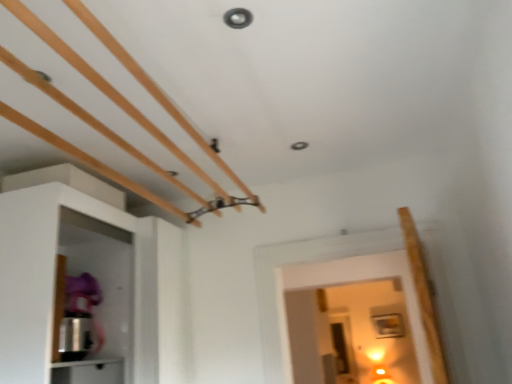
What do you see at coordinates (99, 285) in the screenshot? The image size is (512, 384). I see `white matte cabinet at left, which appears as the 1th cabinetry when viewed from the top` at bounding box center [99, 285].

The width and height of the screenshot is (512, 384). I want to click on white matte cabinet at left, which appears as the 1th cabinetry when viewed from the top, so click(x=99, y=285).

Identify the location of white glossy cabinet at lower left, the first cabinetry from the bottom. The height and width of the screenshot is (384, 512). (88, 372).

In order to face white glossy cabinet at lower left, the first cabinetry from the bottom, should I rotate leftwards or rightwards?

To face it directly, rotate left by 22.761 degrees.

What do you see at coordinates (88, 372) in the screenshot?
I see `white glossy cabinet at lower left, the first cabinetry from the bottom` at bounding box center [88, 372].

Where is `white matte cabinet at left, which appears as the 1th cabinetry when viewed from the top`? The image size is (512, 384). white matte cabinet at left, which appears as the 1th cabinetry when viewed from the top is located at coordinates (99, 285).

Can you confirm if white matte cabinet at left, the second cabinetry from the bottom, is positioned to the right of white glossy cabinet at lower left, the first cabinetry from the bottom?

Incorrect, white matte cabinet at left, the second cabinetry from the bottom, is not on the right side of white glossy cabinet at lower left, the first cabinetry from the bottom.

Who is more distant, white matte cabinet at left, the second cabinetry from the bottom, or white glossy cabinet at lower left, the first cabinetry from the bottom?

white glossy cabinet at lower left, the first cabinetry from the bottom, is further from the camera.

Which is closer to the camera, (7,232) or (83,382)?

Point (7,232) appears to be closer to the viewer than point (83,382).

From the image's perspective, between white matte cabinet at left, the second cabinetry from the bottom, and white glossy cabinet at lower left, the second cabinetry viewed from the top, who is located below?

white glossy cabinet at lower left, the second cabinetry viewed from the top, is shown below in the image.

From a real-world perspective, does white matte cabinet at left, the second cabinetry from the bottom, stand above white glossy cabinet at lower left, the second cabinetry viewed from the top?

Yes, from a real-world perspective, white matte cabinet at left, the second cabinetry from the bottom, is on top of white glossy cabinet at lower left, the second cabinetry viewed from the top.

Considering the sizes of white matte cabinet at left, the second cabinetry from the bottom, and white glossy cabinet at lower left, the first cabinetry from the bottom, in the image, is white matte cabinet at left, the second cabinetry from the bottom, wider or thinner than white glossy cabinet at lower left, the first cabinetry from the bottom,?

Considering their sizes, white matte cabinet at left, the second cabinetry from the bottom, looks broader than white glossy cabinet at lower left, the first cabinetry from the bottom.

Between white matte cabinet at left, the second cabinetry from the bottom, and white glossy cabinet at lower left, the first cabinetry from the bottom, which one has more height?

Standing taller between the two is white matte cabinet at left, the second cabinetry from the bottom.

Which of these two, white matte cabinet at left, the second cabinetry from the bottom, or white glossy cabinet at lower left, the second cabinetry viewed from the top, is smaller?

white glossy cabinet at lower left, the second cabinetry viewed from the top, is smaller.

Based on the photo, would you say white matte cabinet at left, which appears as the 1th cabinetry when viewed from the top, is outside white glossy cabinet at lower left, the first cabinetry from the bottom?

white matte cabinet at left, which appears as the 1th cabinetry when viewed from the top, is positioned outside white glossy cabinet at lower left, the first cabinetry from the bottom.

Is white matte cabinet at left, which appears as the 1th cabinetry when viewed from the top, touching white glossy cabinet at lower left, the second cabinetry viewed from the top?

No.

Is white matte cabinet at left, which appears as the 1th cabinetry when viewed from the top, positioned with its back to white glossy cabinet at lower left, the second cabinetry viewed from the top?

Yes, white glossy cabinet at lower left, the second cabinetry viewed from the top, is at the back of white matte cabinet at left, which appears as the 1th cabinetry when viewed from the top.

How many degrees apart are the facing directions of white matte cabinet at left, which appears as the 1th cabinetry when viewed from the top, and white glossy cabinet at lower left, the second cabinetry viewed from the top?

The angular difference between white matte cabinet at left, which appears as the 1th cabinetry when viewed from the top, and white glossy cabinet at lower left, the second cabinetry viewed from the top, is 1.78 degrees.

Identify the location of cabinetry to the right of white matte cabinet at left, the second cabinetry from the bottom. This screenshot has width=512, height=384. (88, 372).

Between white glossy cabinet at lower left, the first cabinetry from the bottom, and white matte cabinet at left, the second cabinetry from the bottom, which one appears on the left side from the viewer's perspective?

white matte cabinet at left, the second cabinetry from the bottom, is more to the left.

Is white glossy cabinet at lower left, the second cabinetry viewed from the top, in front of or behind white matte cabinet at left, which appears as the 1th cabinetry when viewed from the top, in the image?

In the image, white glossy cabinet at lower left, the second cabinetry viewed from the top, appears behind white matte cabinet at left, which appears as the 1th cabinetry when viewed from the top.

Is point (87, 361) farther from camera compared to point (20, 283)?

Yes, it is behind point (20, 283).

Looking at this image, from the image's perspective, is white glossy cabinet at lower left, the first cabinetry from the bottom, on white matte cabinet at left, the second cabinetry from the bottom?

No.

From a real-world perspective, which is physically below, white glossy cabinet at lower left, the second cabinetry viewed from the top, or white matte cabinet at left, the second cabinetry from the bottom?

white glossy cabinet at lower left, the second cabinetry viewed from the top, from a real-world perspective.

In terms of width, does white glossy cabinet at lower left, the first cabinetry from the bottom, look wider or thinner when compared to white matte cabinet at left, which appears as the 1th cabinetry when viewed from the top?

In the image, white glossy cabinet at lower left, the first cabinetry from the bottom, appears to be more narrow than white matte cabinet at left, which appears as the 1th cabinetry when viewed from the top.

Can you confirm if white glossy cabinet at lower left, the first cabinetry from the bottom, is taller than white matte cabinet at left, which appears as the 1th cabinetry when viewed from the top?

Incorrect, the height of white glossy cabinet at lower left, the first cabinetry from the bottom, is not larger of that of white matte cabinet at left, which appears as the 1th cabinetry when viewed from the top.

Can you confirm if white glossy cabinet at lower left, the first cabinetry from the bottom, is smaller than white matte cabinet at left, the second cabinetry from the bottom?

Yes, white glossy cabinet at lower left, the first cabinetry from the bottom, is smaller than white matte cabinet at left, the second cabinetry from the bottom.

Looking at this image, is white glossy cabinet at lower left, the second cabinetry viewed from the top, inside the boundaries of white matte cabinet at left, which appears as the 1th cabinetry when viewed from the top, or outside?

white glossy cabinet at lower left, the second cabinetry viewed from the top, is enclosed within white matte cabinet at left, which appears as the 1th cabinetry when viewed from the top.

Based on the photo, is white glossy cabinet at lower left, the first cabinetry from the bottom, beside white matte cabinet at left, the second cabinetry from the bottom?

No, white glossy cabinet at lower left, the first cabinetry from the bottom, is not beside white matte cabinet at left, the second cabinetry from the bottom.

Is white glossy cabinet at lower left, the second cabinetry viewed from the top, aimed at white matte cabinet at left, which appears as the 1th cabinetry when viewed from the top?

Yes, white glossy cabinet at lower left, the second cabinetry viewed from the top, is turned towards white matte cabinet at left, which appears as the 1th cabinetry when viewed from the top.

What's the angular difference between white glossy cabinet at lower left, the second cabinetry viewed from the top, and white matte cabinet at left, the second cabinetry from the bottom,'s facing directions?

1.78 degrees.

The width and height of the screenshot is (512, 384). In the image, there is a white glossy cabinet at lower left, the first cabinetry from the bottom. Find the location of `cabinetry above it (from the image's perspective)`. cabinetry above it (from the image's perspective) is located at coordinates (99, 285).

Find the location of a particular element. cabinetry below the white matte cabinet at left, which appears as the 1th cabinetry when viewed from the top (from the image's perspective) is located at coordinates (88, 372).

In order to click on cabinetry that is above the white glossy cabinet at lower left, the second cabinetry viewed from the top (from a real-world perspective) in this screenshot , I will do `click(99, 285)`.